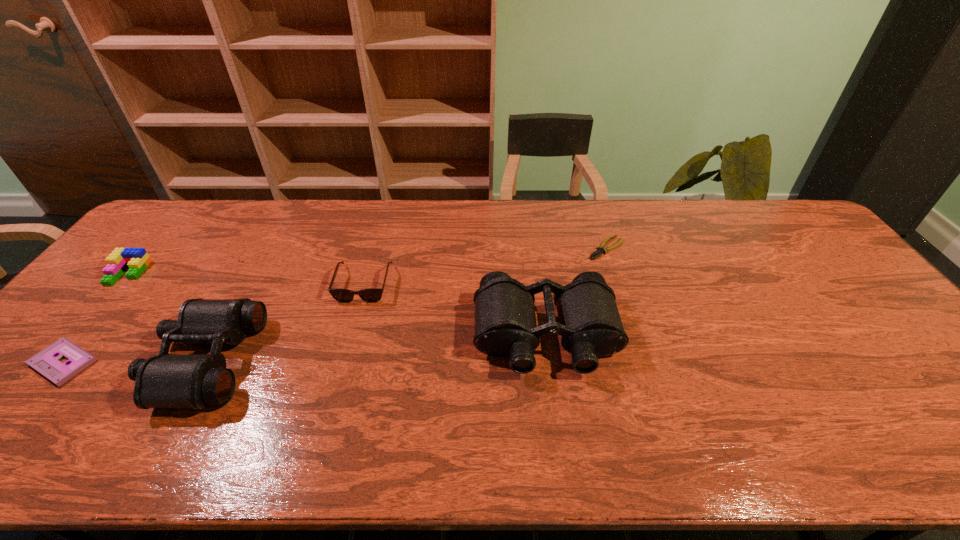
Locate an element on the screen. free space between the videotape and the right binoculars is located at coordinates [x=304, y=349].

This screenshot has width=960, height=540. What are the coordinates of `empty space that is in between the shortest object and the Lego` in the screenshot? It's located at click(x=367, y=260).

Where is `vacant space that's between the Lego and the third object from right to left`? This screenshot has height=540, width=960. vacant space that's between the Lego and the third object from right to left is located at coordinates (246, 278).

You are a GUI agent. You are given a task and a screenshot of the screen. Output one action in this format:
    pyautogui.click(x=<x>, y=<y>)
    Task: Click on the object that is the fourth closest to the sunglasses
    The image size is (960, 540).
    Given the screenshot: What is the action you would take?
    pyautogui.click(x=137, y=259)

This screenshot has width=960, height=540. Find the location of `object that is the fifth closest to the videotape`. object that is the fifth closest to the videotape is located at coordinates (601, 249).

This screenshot has height=540, width=960. What are the coordinates of `free location that satisfies the following two spatial constraints: 1. at the front lenses of the sunglasses; 2. through the eyepieces of the second tallest object` in the screenshot? It's located at (343, 360).

Identify the location of vacant position in the image that satisfies the following two spatial constraints: 1. at the front lenses of the third object from right to left; 2. through the eyepieces of the fourth object from right to left. (343, 360).

The height and width of the screenshot is (540, 960). What are the coordinates of `free location that satisfies the following two spatial constraints: 1. through the eyepieces of the taller binoculars; 2. through the eyepieces of the shorter binoculars` in the screenshot? It's located at (549, 360).